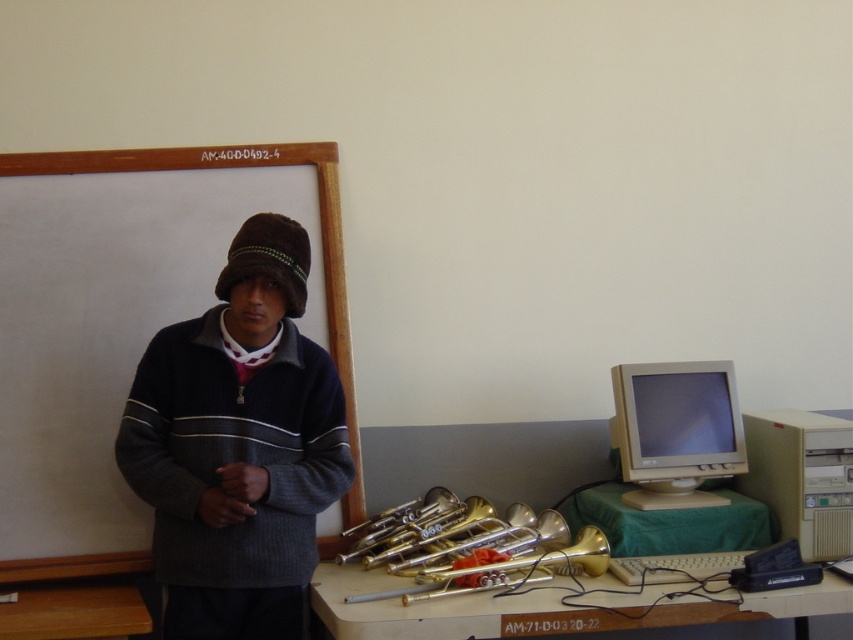
Based on the photo, you are a student trying to reach the brown wooden table at lower left to grab your trumpet. The dark blue knitted sweater at center is in your way. Can you walk around the sweater to get to the table?

The brown wooden table at lower left is behind the dark blue knitted sweater at center, so you can walk around the sweater to reach the table.

You are a student trying to reach the metallic brass instruments at lower center and the brown wooden table at lower left. Which object is closer to you?

The metallic brass instruments at lower center are closer to you than the brown wooden table at lower left.

You are setting up a presentation in this room and need to place a large poster. Which object, the beige plastic monitor at right or the white matte chalkboard at upper left, would be more suitable for mounting the poster?

The white matte chalkboard at upper left is more suitable for mounting the poster since it is larger than the beige plastic monitor at right.